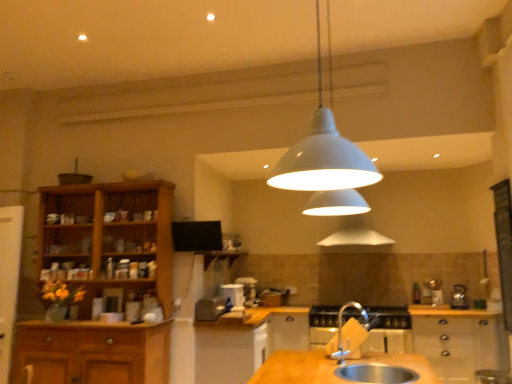
Question: Does point (393, 372) appear closer or farther from the camera than point (420, 327)?

Choices:
 (A) farther
 (B) closer

Answer: (B)

Question: From a real-world perspective, is silver metallic sink at lower center positioned above or below white glossy cabinet at lower right, which is counted as the third cabinetry, starting from the left?

Choices:
 (A) above
 (B) below

Answer: (A)

Question: Considering the real-world distances, which object is farthest from the satin silver kettle at center, acting as the third appliance starting from the right?

Choices:
 (A) white glossy cabinet at lower right, which is counted as the third cabinetry, starting from the left
 (B) wooden cabinet at left, placed as the third cabinetry when sorted from right to left
 (C) silver metallic kettle at right, the 4th appliance in the left-to-right sequence
 (D) white glossy cabinet at left, which is the 1th appliance in left-to-right order
 (E) wooden shelf at center

Answer: (C)

Question: Estimate the real-world distances between objects in this image. Which object is closer to the wooden shelf at center?

Choices:
 (A) silver metallic kettle at right, the 1th appliance positioned from the right
 (B) silver metallic sink at lower center
 (C) white glossy cabinet at left, which is the 1th appliance in left-to-right order
 (D) wooden cabinet at center, the second cabinetry when ordered from right to left
 (E) metallic silver gas stove at center

Answer: (D)